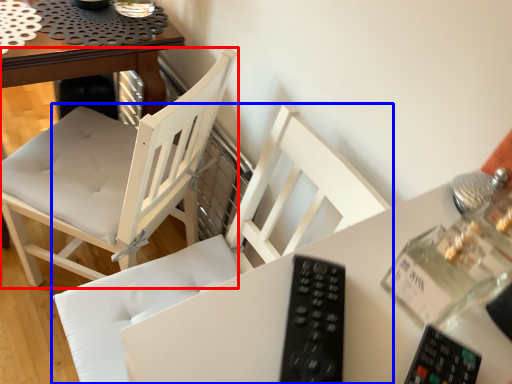
Question: Which object is closer to the camera taking this photo, chair (highlighted by a red box) or chair (highlighted by a blue box)?

Choices:
 (A) chair
 (B) chair

Answer: (B)